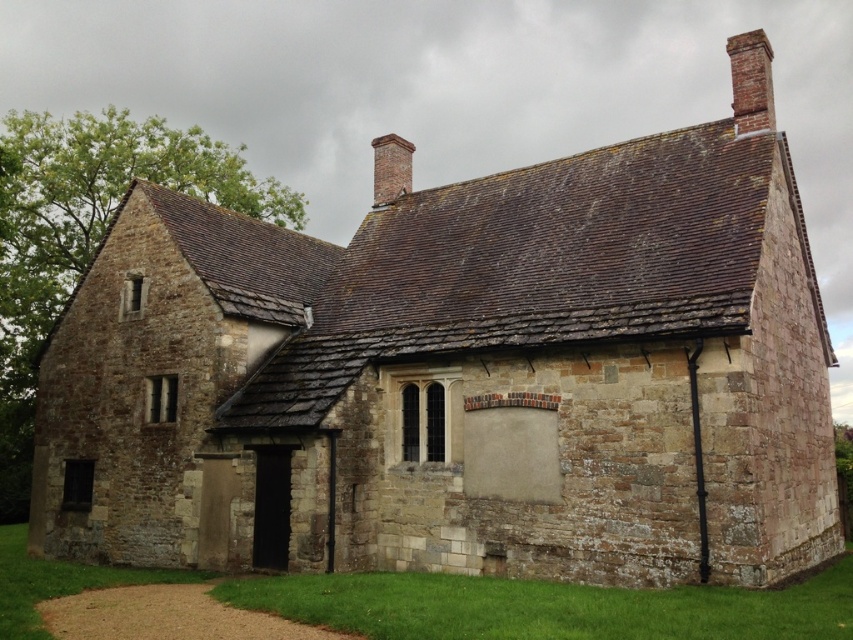
Between brick chimney at upper right and brick chimney at upper center, which one is positioned lower?

brick chimney at upper center

Who is more forward, (740, 129) or (410, 172)?

Positioned in front is point (740, 129).

What do you see at coordinates (751, 81) in the screenshot?
I see `brick chimney at upper right` at bounding box center [751, 81].

This screenshot has width=853, height=640. I want to click on brick chimney at upper right, so click(751, 81).